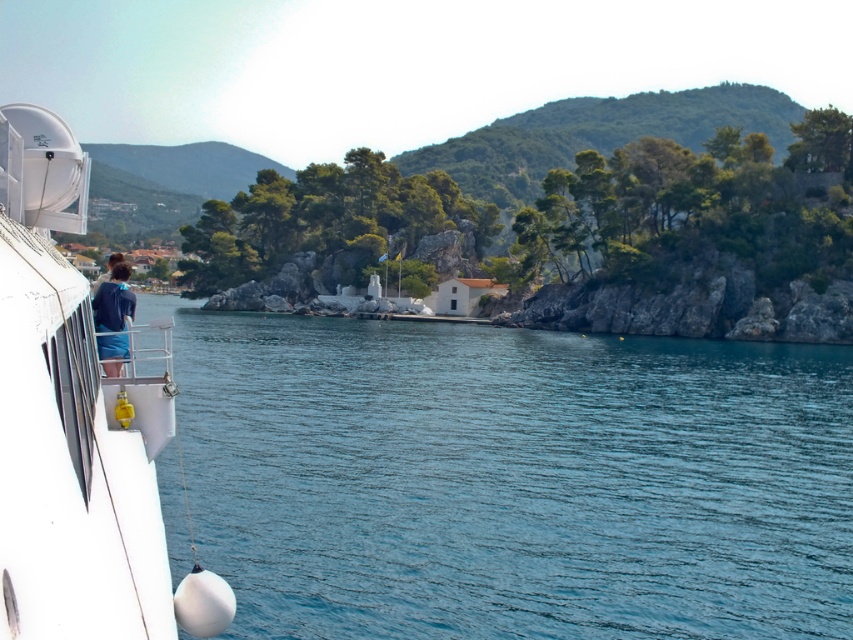
Can you confirm if white glossy boat at left is thinner than blue denim shorts at left?

In fact, white glossy boat at left might be wider than blue denim shorts at left.

Where is `white glossy boat at left`? The height and width of the screenshot is (640, 853). white glossy boat at left is located at coordinates (77, 426).

Find the location of a particular element. The height and width of the screenshot is (640, 853). white glossy boat at left is located at coordinates (77, 426).

Which is in front, point (718, 560) or point (103, 481)?

Point (103, 481) is more forward.

Is point (291, 378) farther from viewer compared to point (80, 573)?

Yes, point (291, 378) is behind point (80, 573).

Where is `clear blue water at center`? The height and width of the screenshot is (640, 853). clear blue water at center is located at coordinates (514, 480).

Is point (409, 396) positioned after point (108, 333)?

Yes, point (409, 396) is farther from viewer.

Consider the image. Who is higher up, clear blue water at center or blue denim shorts at left?

Positioned higher is blue denim shorts at left.

Where is `clear blue water at center`? clear blue water at center is located at coordinates pos(514,480).